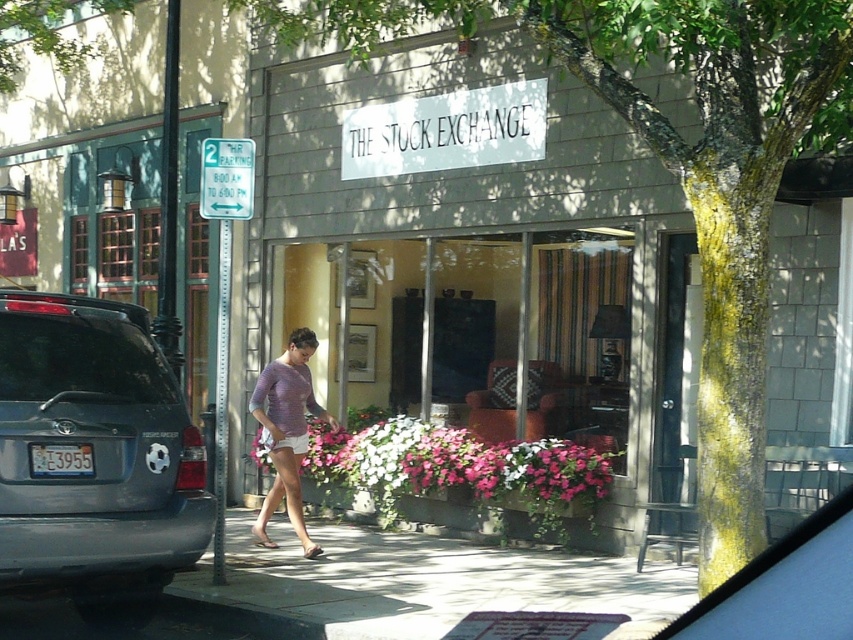
Is matte gray storefront at center to the left of gray matte suv at left from the viewer's perspective?

Incorrect, matte gray storefront at center is not on the left side of gray matte suv at left.

Does point (657, 22) come in front of point (119, 536)?

That is True.

Identify the location of matte gray storefront at center. (679, 164).

Locate an element on the screen. The height and width of the screenshot is (640, 853). matte gray storefront at center is located at coordinates (679, 164).

Can you confirm if matte gray storefront at center is positioned to the right of knitted purple sweater at center?

Yes, matte gray storefront at center is to the right of knitted purple sweater at center.

Is matte gray storefront at center further to the viewer compared to knitted purple sweater at center?

No.

In the scene shown: Who is more distant from viewer, (735, 177) or (274, 426)?

Point (274, 426)

At what (x,y) coordinates should I click in order to perform the action: click on matte gray storefront at center. Please return your answer as a coordinate pair (x, y). Looking at the image, I should click on tap(679, 164).

Is the position of gray matte suv at left more distant than that of knitted purple sweater at center?

That is False.

The image size is (853, 640). What do you see at coordinates (93, 454) in the screenshot? I see `gray matte suv at left` at bounding box center [93, 454].

Who is more distant from viewer, (3,410) or (271,496)?

The point (271,496) is behind.

The height and width of the screenshot is (640, 853). I want to click on gray matte suv at left, so click(x=93, y=454).